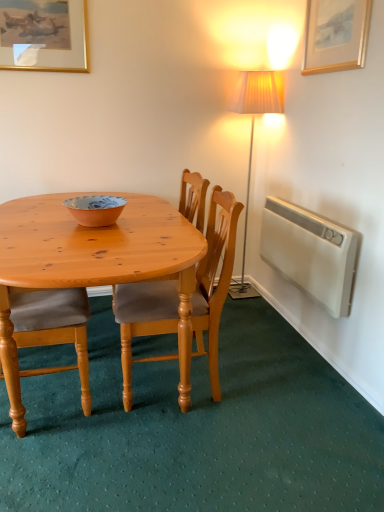
The width and height of the screenshot is (384, 512). What are the coordinates of `free space to the right of light brown wood chair at center, the 2th chair positioned from the left` in the screenshot? It's located at (281, 414).